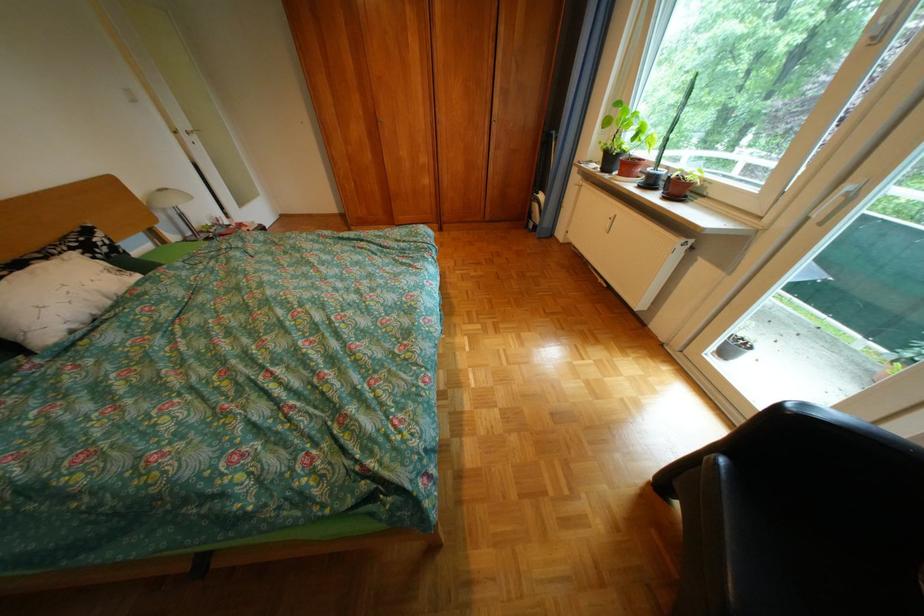
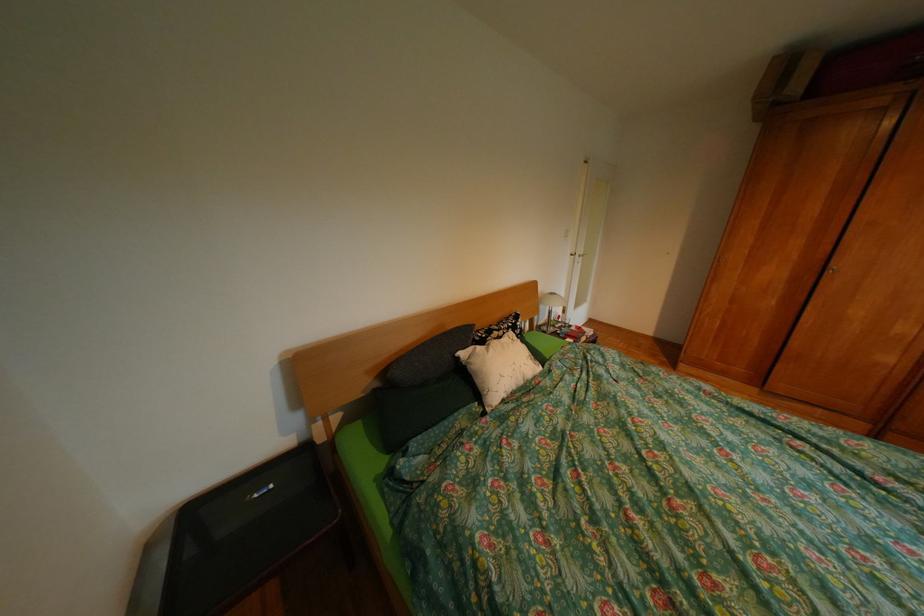
Question: The first image is from the beginning of the video and the second image is from the end. How did the camera likely rotate when shooting the video?

Choices:
 (A) Left
 (B) Right
 (C) Up
 (D) Down

Answer: (A)